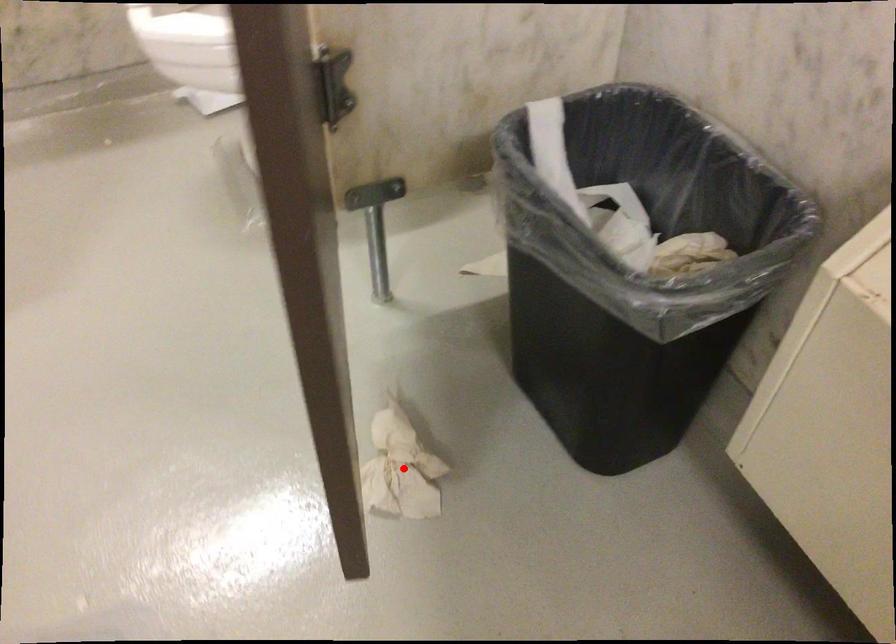
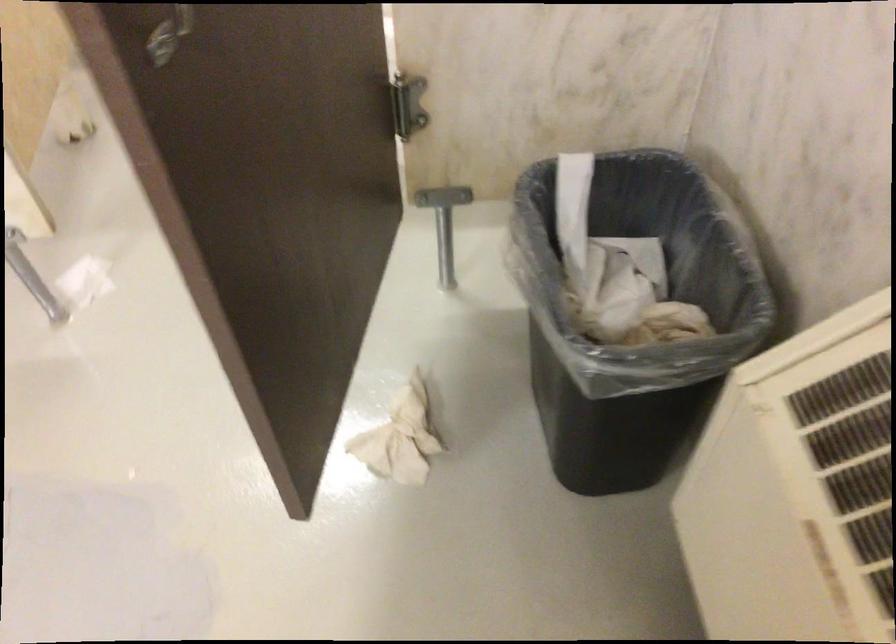
Question: I am providing you with two images of the same scene from different viewpoints. In image1, a red point is highlighted. Considering the same 3D point in image2, which of the following is correct?

Choices:
 (A) It is closer
 (B) It is farther

Answer: (B)